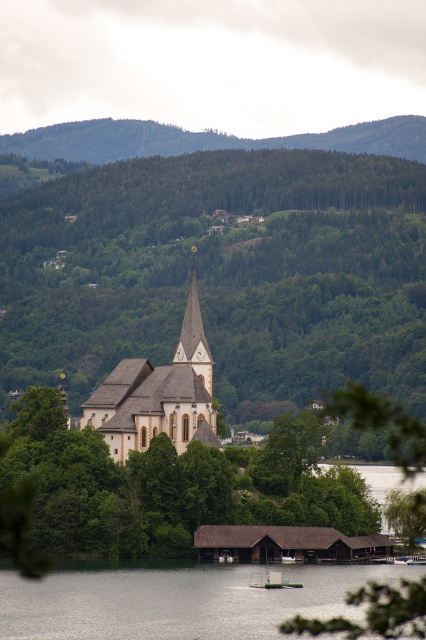
Which is in front, point (273, 369) or point (60, 588)?

Point (60, 588)

Is green leafy tree at center smaller than transparent water at lower center?

Incorrect, green leafy tree at center is not smaller in size than transparent water at lower center.

You are a GUI agent. You are given a task and a screenshot of the screen. Output one action in this format:
    pyautogui.click(x=<x>, y=<y>)
    Task: Click on the green leafy tree at center
    The height and width of the screenshot is (640, 426).
    Given the screenshot: What is the action you would take?
    pyautogui.click(x=222, y=273)

Can you confirm if transparent water at lower center is bigger than white stone church at center?

No, transparent water at lower center is not bigger than white stone church at center.

Which of these two, transparent water at lower center or white stone church at center, stands shorter?

transparent water at lower center

Which is behind, point (57, 604) or point (120, 392)?

Positioned behind is point (120, 392).

Image resolution: width=426 pixels, height=640 pixels. I want to click on transparent water at lower center, so click(x=178, y=600).

Can you confirm if transparent water at lower center is wider than green forested hillside at upper center?

No.

Between point (25, 636) and point (379, 147), which one is positioned behind?

Positioned behind is point (379, 147).

Image resolution: width=426 pixels, height=640 pixels. Identify the location of transparent water at lower center. (178, 600).